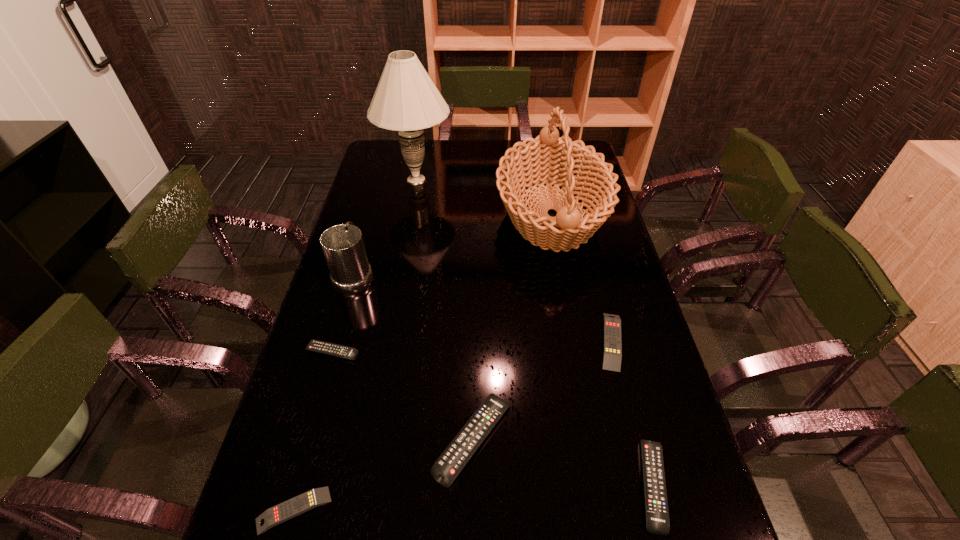
Where is `beige lampshade`? The width and height of the screenshot is (960, 540). beige lampshade is located at coordinates (406, 100).

Locate an element on the screen. This screenshot has width=960, height=540. the tallest object is located at coordinates (406, 100).

Where is `the seventh shortest object`? the seventh shortest object is located at coordinates (548, 159).

Where is `basket`? This screenshot has height=540, width=960. basket is located at coordinates (548, 159).

Where is `the third tallest object`? This screenshot has height=540, width=960. the third tallest object is located at coordinates (343, 247).

Where is `mug`? This screenshot has width=960, height=540. mug is located at coordinates (343, 247).

Find the location of a particular element. The width and height of the screenshot is (960, 540). the right yellow remote control is located at coordinates (612, 345).

Identify the location of the farther yellow remote control. (612, 345).

The image size is (960, 540). In order to click on the third remote control from left to right in this screenshot , I will do `click(448, 466)`.

The image size is (960, 540). In order to click on the biggest black remote control in this screenshot , I will do `click(448, 466)`.